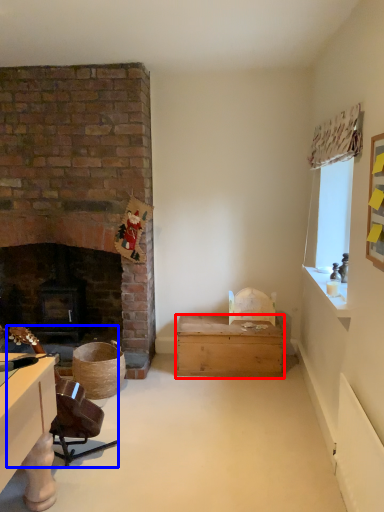
Question: Which of the following is the farthest to the observer, box (highlighted by a red box) or swivel chair (highlighted by a blue box)?

Choices:
 (A) box
 (B) swivel chair

Answer: (A)